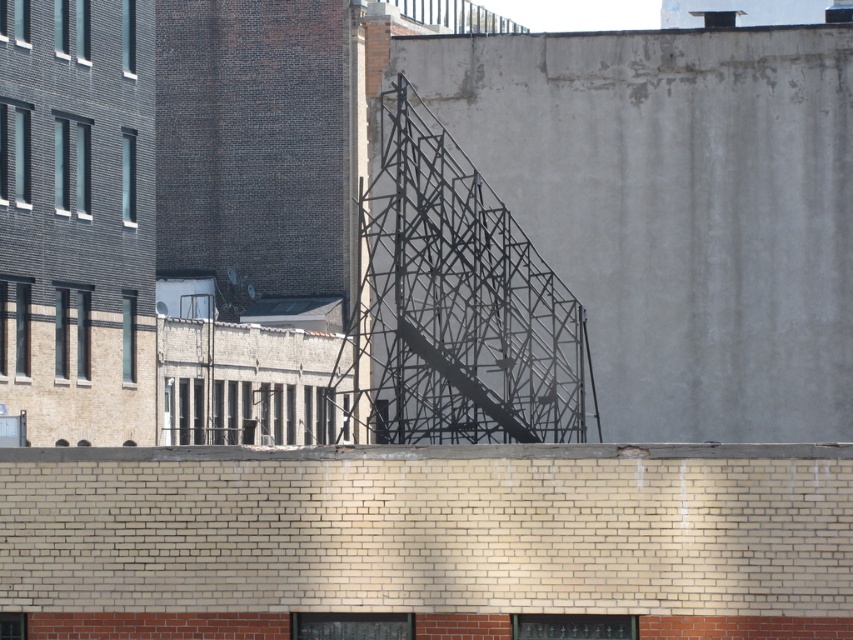
You are a painter needing to move a 1.2 meter wide ladder between the metallic scaffolding at center and the metallic gray staircase at center. Can the ladder fit through the space between them?

The metallic scaffolding at center might be wider than metallic gray staircase at center, so the ladder might not fit through the space between them. Check the actual width before moving the ladder.

You are a painter needing to choose between two structures to paint. You have a limited amount of paint that can cover an area of 2 square meters. Given that the metallic scaffolding at center and the metallic gray staircase at center are both made of the same material, which structure would you choose to paint completely without running out of paint?

The metallic gray staircase at center has a smaller size compared to the metallic scaffolding at center. Since the paint can only cover 2 square meters, the metallic gray staircase at center would require less paint and thus can be fully painted without exceeding the paint limit.

You are standing on the rooftop and want to move from the point at coordinates point (409, 278) to the point at coordinates point (427, 355). Which direction should you move to reach your destination?

To move from point (409, 278) to point (427, 355), you should move forward because point (409, 278) is behind point (427, 355).